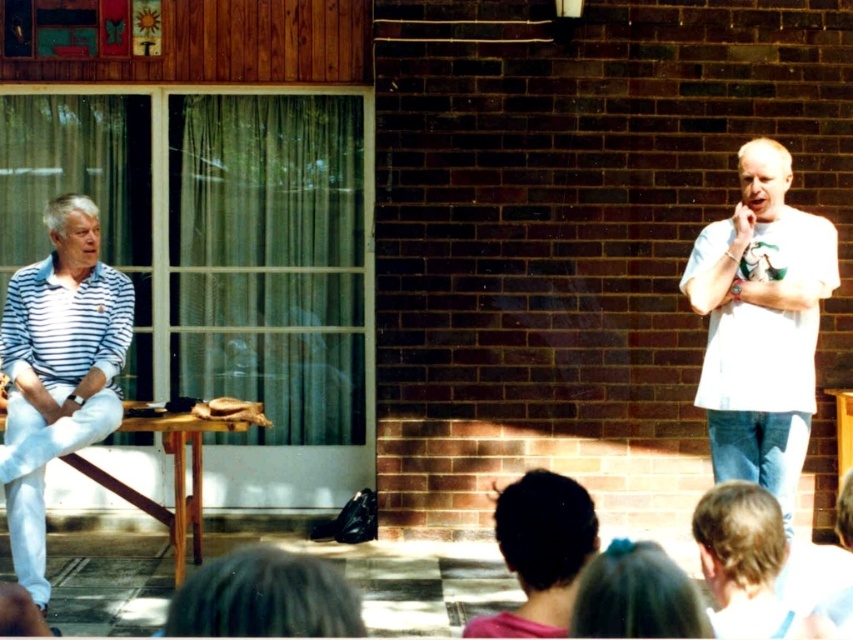
You are an event planner observing the scene. You need to seat a guest between the two men wearing white cotton shirt at right and white striped polo shirt at left. Where should the guest sit relative to the existing seating arrangement?

The guest should sit to the left of the white cotton shirt at right, as it is positioned to the right of the white striped polo shirt at left, creating space between them.

You are standing at point A located at coordinates point A at (740, 164). You want to walk to point B located at coordinates point B at 0.741, 0.132. The path between them is a straight line. If your walking speed is 1.2 meters per second, how many seconds will it take you to reach point B from point A?

The distance between point A at (740, 164) and point B at 0.741, 0.132 is 4.86 meters. At a walking speed of 1.2 meters per second, it will take 4.86 divided by 1.2 equals 4.05 seconds. So approximately 4.05 seconds.